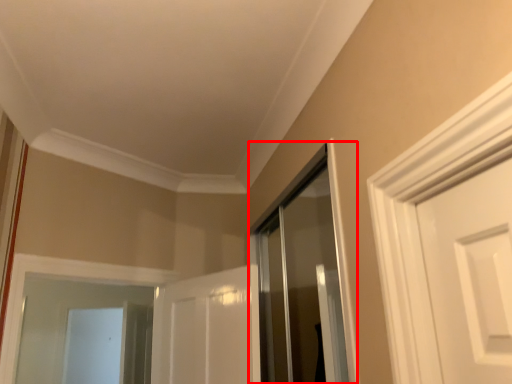
Question: Considering the relative positions of shower door (annotated by the red box) and screen door in the image provided, where is shower door (annotated by the red box) located with respect to the staircase?

Choices:
 (A) right
 (B) left

Answer: (A)